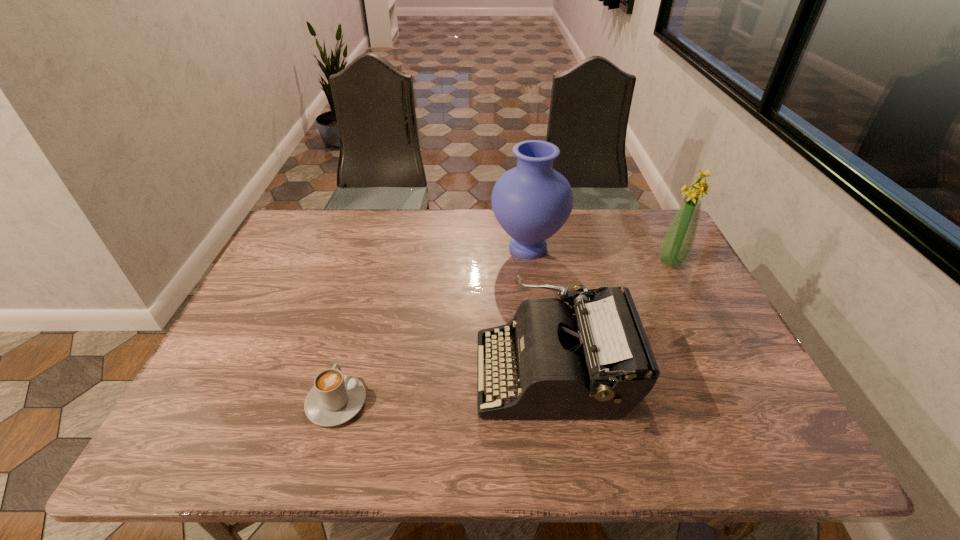
Locate an element on the screen. The width and height of the screenshot is (960, 540). vacant area that lies between the second shortest object and the shortest object is located at coordinates (444, 388).

Find the location of a particular element. Image resolution: width=960 pixels, height=540 pixels. the third closest object relative to the vase is located at coordinates (335, 398).

This screenshot has height=540, width=960. I want to click on object that can be found as the third closest to the vase, so click(x=335, y=398).